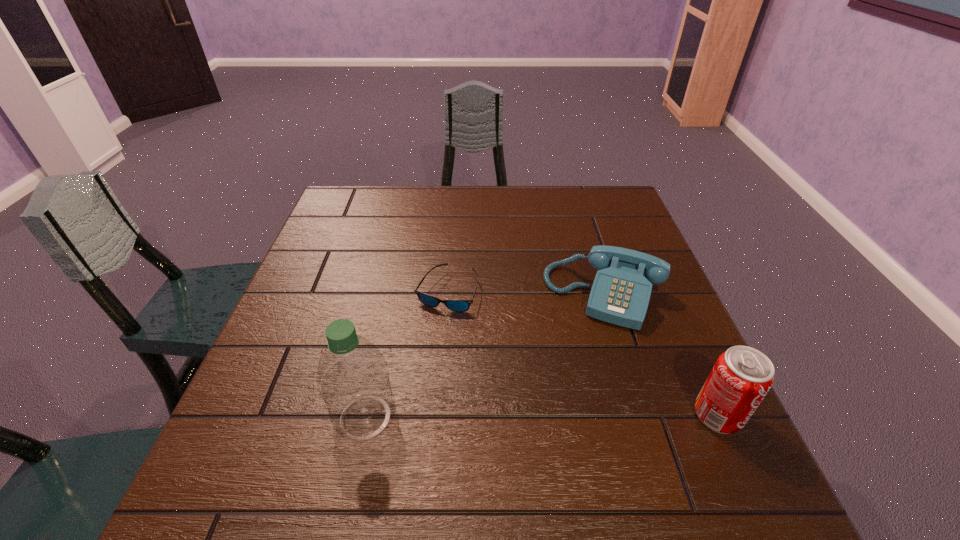
Identify the location of empty space between the telephone and the tallest object. (485, 356).

I want to click on empty space that is in between the sunglasses and the third tallest object, so click(x=526, y=293).

This screenshot has height=540, width=960. What are the coordinates of `free point between the tallest object and the soda can` in the screenshot? It's located at [x=541, y=416].

The image size is (960, 540). Identify the location of vacant area that lies between the water bottle and the third object from right to left. (407, 354).

Where is `object that is the closest one to the telephone`? This screenshot has height=540, width=960. object that is the closest one to the telephone is located at coordinates pyautogui.click(x=455, y=305).

You are a GUI agent. You are given a task and a screenshot of the screen. Output one action in this format:
    pyautogui.click(x=<x>, y=<y>)
    Task: Click on the object that is the third nearest to the second tallest object
    Image resolution: width=960 pixels, height=540 pixels.
    Given the screenshot: What is the action you would take?
    pyautogui.click(x=353, y=380)

Identify the location of free spot that satisfies the following two spatial constraints: 1. on the front side of the third shortest object; 2. on the left side of the telephone. (640, 415).

Identify the location of free space that satisfies the following two spatial constraints: 1. on the front side of the second shortest object; 2. on the right side of the second object from left to right. (447, 296).